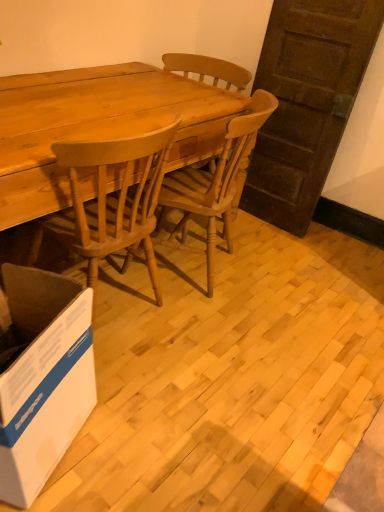
Question: Is light brown wood chair at center wider or thinner than white cardboard box at lower left?

Choices:
 (A) thin
 (B) wide

Answer: (B)

Question: From the image's perspective, is light brown wood chair at center positioned above or below white cardboard box at lower left?

Choices:
 (A) above
 (B) below

Answer: (A)

Question: Which object is positioned farthest from the white cardboard box at lower left?

Choices:
 (A) light brown wood desk at center
 (B) light brown wood chair at center

Answer: (B)

Question: Estimate the real-world distances between objects in this image. Which object is closer to the light brown wood chair at center?

Choices:
 (A) white cardboard box at lower left
 (B) light brown wood desk at center

Answer: (B)